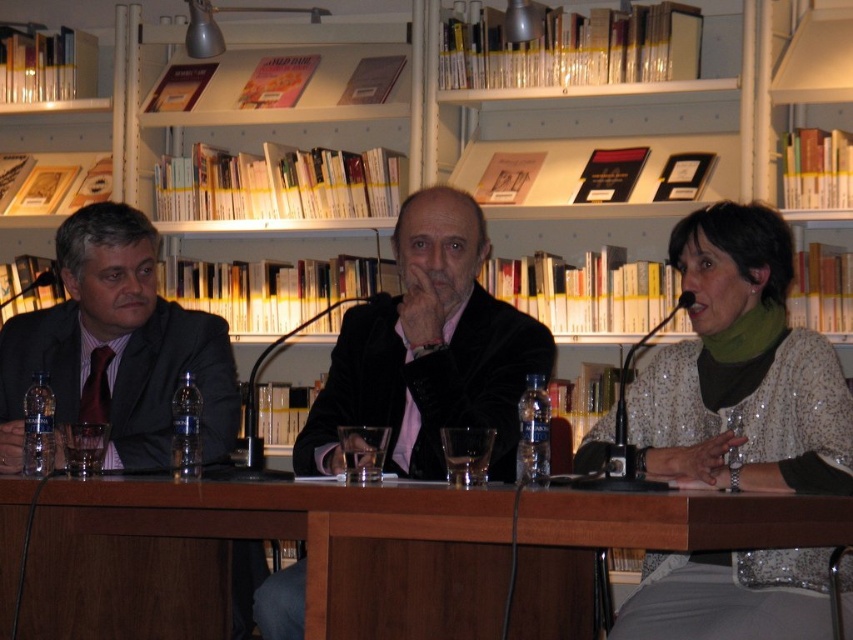
Who is positioned more to the left, velvet black jacket at center or matte black suit at left?

matte black suit at left is more to the left.

Who is higher up, velvet black jacket at center or matte black suit at left?

velvet black jacket at center

Based on the photo, measure the distance between velvet black jacket at center and camera.

velvet black jacket at center and camera are 2.01 meters apart from each other.

Locate an element on the screen. Image resolution: width=853 pixels, height=640 pixels. velvet black jacket at center is located at coordinates (428, 349).

What do you see at coordinates (424, 333) in the screenshot?
I see `white glossy bookshelf at upper center` at bounding box center [424, 333].

Can you confirm if white glossy bookshelf at upper center is shorter than matte black suit at left?

Indeed, white glossy bookshelf at upper center has a lesser height compared to matte black suit at left.

I want to click on white glossy bookshelf at upper center, so click(x=424, y=333).

What do you see at coordinates (741, 369) in the screenshot? I see `sparkly silver blouse at center` at bounding box center [741, 369].

You are a GUI agent. You are given a task and a screenshot of the screen. Output one action in this format:
    pyautogui.click(x=<x>, y=<y>)
    Task: Click on the sparkly silver blouse at center
    This screenshot has height=640, width=853.
    Given the screenshot: What is the action you would take?
    click(741, 369)